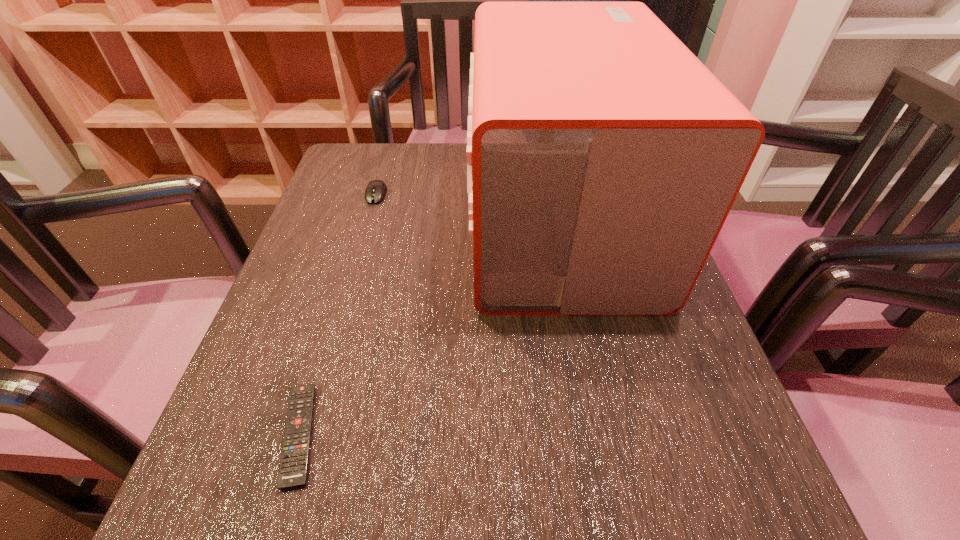
Image resolution: width=960 pixels, height=540 pixels. Identify the location of free space at the near edge of the desktop. [x=502, y=477].

At what (x,y) coordinates should I click in order to perform the action: click on vacant area at the left edge. Please return your answer as a coordinate pair (x, y). Looking at the image, I should click on (322, 312).

Find the location of a particular element. The width and height of the screenshot is (960, 540). vacant space at the right edge is located at coordinates (615, 349).

At what (x,y) coordinates should I click in order to perform the action: click on vacant space at the far left corner. Please return your answer as a coordinate pair (x, y). The image size is (960, 540). Looking at the image, I should click on (378, 144).

Image resolution: width=960 pixels, height=540 pixels. In order to click on vacant space at the near left corner in this screenshot , I will do `click(197, 477)`.

What are the coordinates of `vacant space at the near right corner of the desktop` in the screenshot? It's located at (686, 478).

The height and width of the screenshot is (540, 960). I want to click on vacant area that lies between the computer mouse and the tallest object, so click(468, 208).

At what (x,y) coordinates should I click in order to perform the action: click on vacant space in between the computer mouse and the box. Please return your answer as a coordinate pair (x, y). This screenshot has width=960, height=540. Looking at the image, I should click on (468, 208).

At what (x,y) coordinates should I click in order to perform the action: click on free space between the second shortest object and the tallest object. Please return your answer as a coordinate pair (x, y). Looking at the image, I should click on (468, 208).

You are a GUI agent. You are given a task and a screenshot of the screen. Output one action in this format:
    pyautogui.click(x=<x>, y=<y>)
    Task: Click on the empty space that is in between the second tallest object and the box
    This screenshot has width=960, height=540.
    Given the screenshot: What is the action you would take?
    pyautogui.click(x=468, y=208)